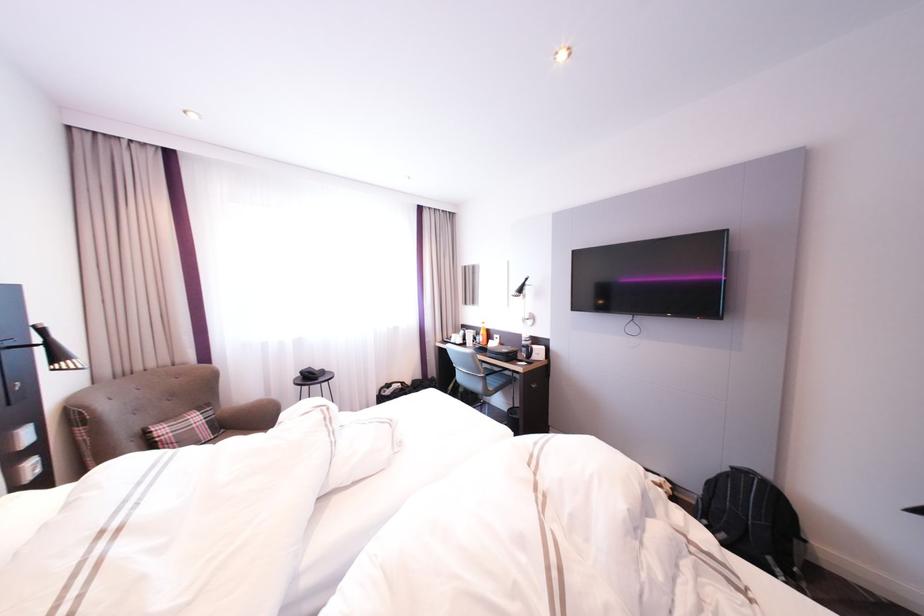
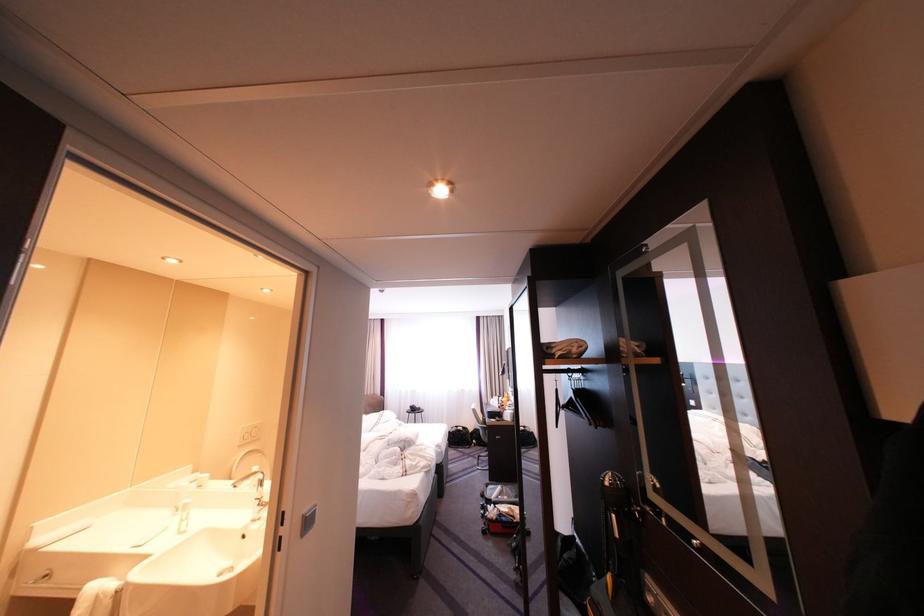
Find the pixel in the second image that matches point (492, 373) in the first image.

(491, 424)